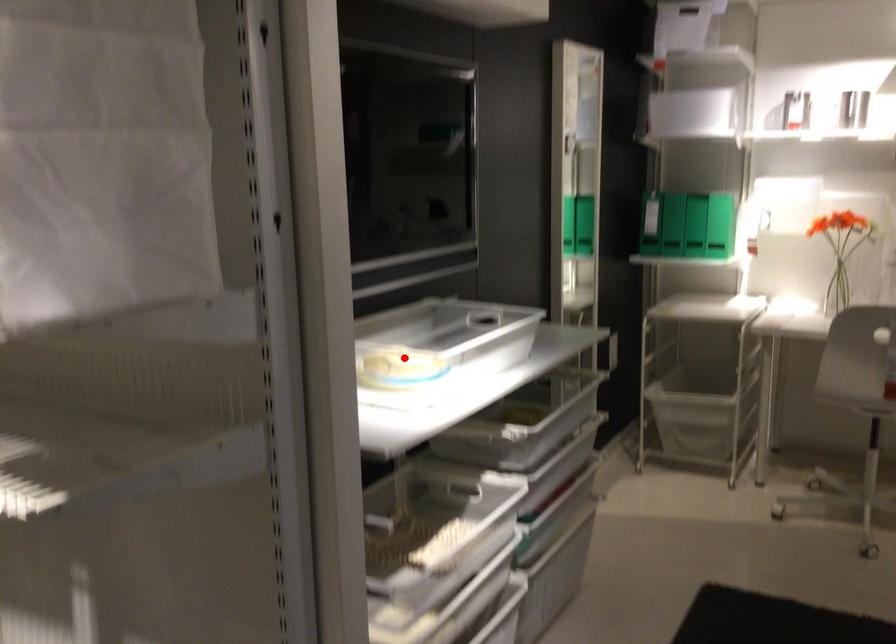
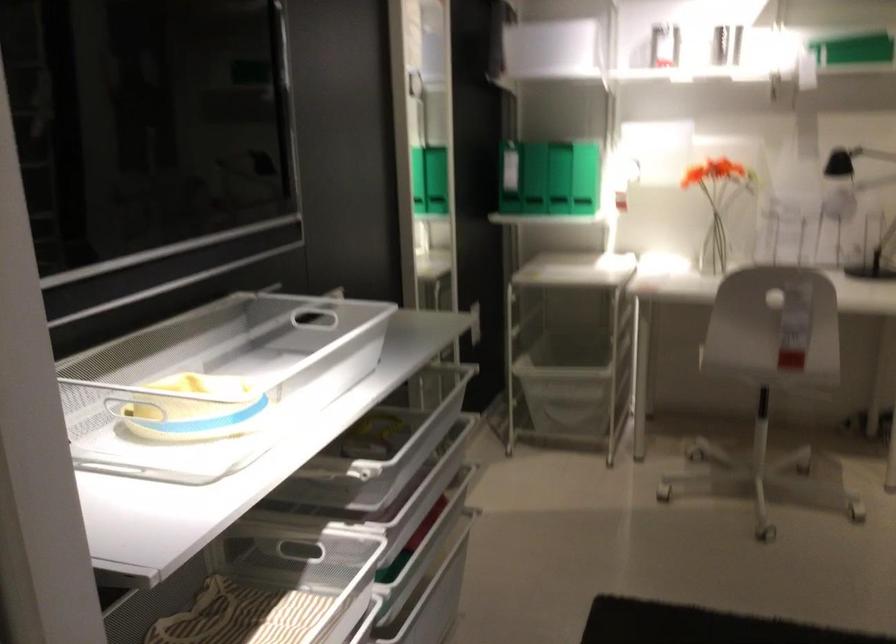
Where in the second image is the point corresponding to the highlighted location from the first image?

(216, 383)